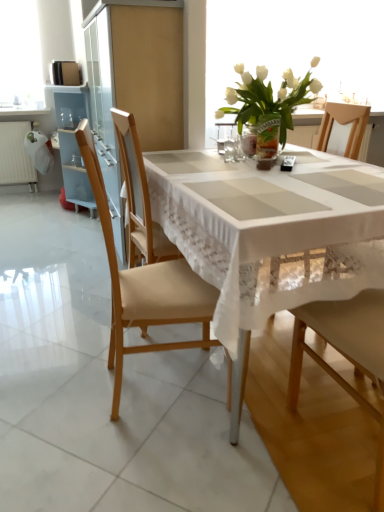
Locate an element on the screen. unoccupied area in front of light brown wood chair at left, acting as the 2th chair starting from the right is located at coordinates (157, 461).